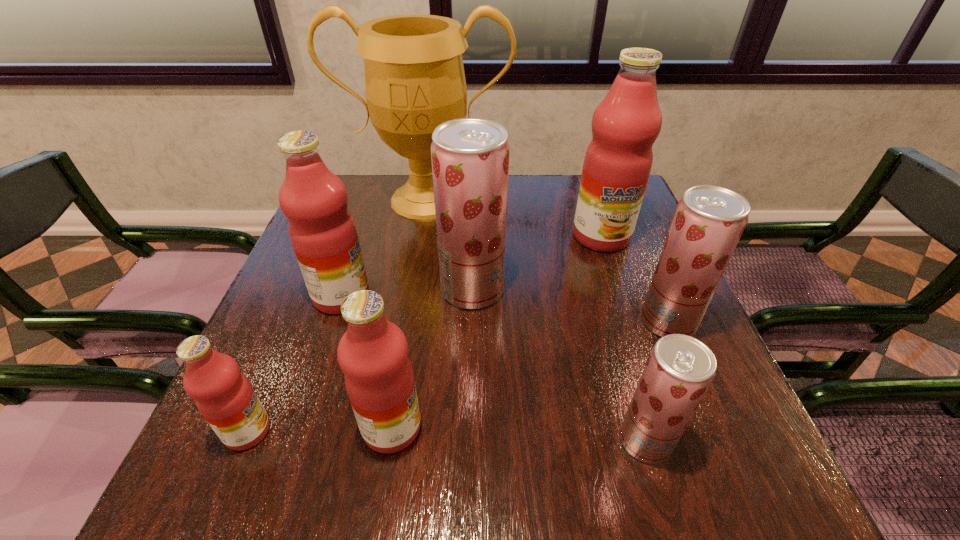
This screenshot has width=960, height=540. Find the location of `vacant space at the near left corner`. vacant space at the near left corner is located at coordinates (261, 475).

You are a GUI agent. You are given a task and a screenshot of the screen. Output one action in this format:
    pyautogui.click(x=<x>, y=<y>)
    Task: Click on the free space at the near right corner of the desktop
    Image resolution: width=960 pixels, height=540 pixels.
    Given the screenshot: What is the action you would take?
    pyautogui.click(x=690, y=466)

Where is `vacant point located between the tallest fruit juice and the biggest strawberry fruit juice`? This screenshot has width=960, height=540. vacant point located between the tallest fruit juice and the biggest strawberry fruit juice is located at coordinates (537, 263).

In order to click on empty location between the smallest strawberry fruit juice and the second biggest pink fruit juice in this screenshot , I will do `click(493, 368)`.

Where is `empty space between the trophy and the rightmost strawberry fruit juice`? empty space between the trophy and the rightmost strawberry fruit juice is located at coordinates (547, 261).

The height and width of the screenshot is (540, 960). What are the coordinates of `unoccupied position between the smallest pink fruit juice and the second smallest pink fruit juice` in the screenshot? It's located at (320, 429).

This screenshot has width=960, height=540. I want to click on empty space that is in between the second pink fruit juice from right to left and the biggest strawberry fruit juice, so click(x=432, y=359).

You are a GUI agent. You are given a task and a screenshot of the screen. Output one action in this format:
    pyautogui.click(x=<x>, y=<y>)
    Task: Click on the vacant region between the nearest strawberry fruit juice and the third biggest pink fruit juice
    Image resolution: width=960 pixels, height=540 pixels.
    Given the screenshot: What is the action you would take?
    pyautogui.click(x=518, y=434)

At what (x,y) coordinates should I click in order to perform the action: click on vacant point located between the trophy and the smallest pink fruit juice. Please return your answer as a coordinate pair (x, y). Looking at the image, I should click on (337, 315).

The height and width of the screenshot is (540, 960). Find the location of `free point between the biggest strawberry fruit juice and the second smallest pink fruit juice`. free point between the biggest strawberry fruit juice and the second smallest pink fruit juice is located at coordinates (432, 359).